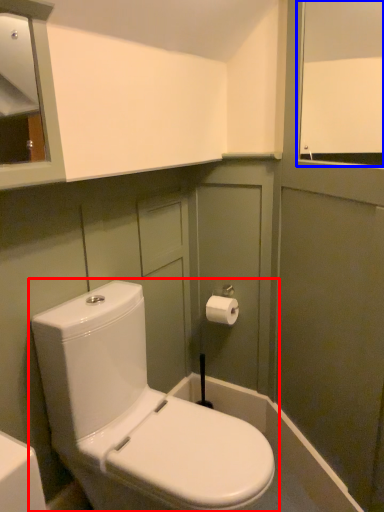
Question: Which object is closer to the camera taking this photo, toilet (highlighted by a red box) or window screen (highlighted by a blue box)?

Choices:
 (A) toilet
 (B) window screen

Answer: (A)